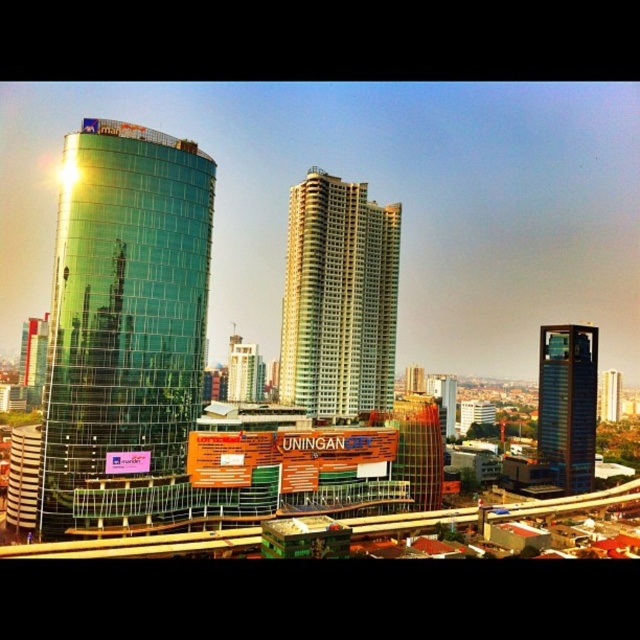
You are standing at the center of the city square, looking towards the glassy blue skyscraper at right. Based on its position in the image, can you estimate its coordinates relative to the square?

The glassy blue skyscraper at right is located at coordinates approximately 0.631 on the x axis and 0.887 on the y axis relative to the square.

You are an architect designing a new park between the gold textured building at center and the glassy blue skyscraper at center. Which building should you place the park closer to if you want it to appear larger in the city layout?

The park should be placed closer to the gold textured building at center because it is larger in size than the glassy blue skyscraper at center, making it more visually dominant in the city layout.